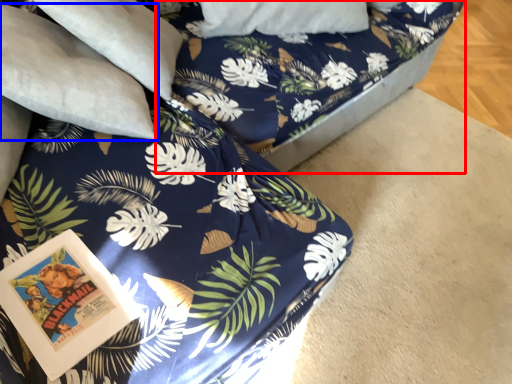
Question: Which point is further to the camera, bed frame (highlighted by a red box) or pillow (highlighted by a blue box)?

Choices:
 (A) bed frame
 (B) pillow

Answer: (A)